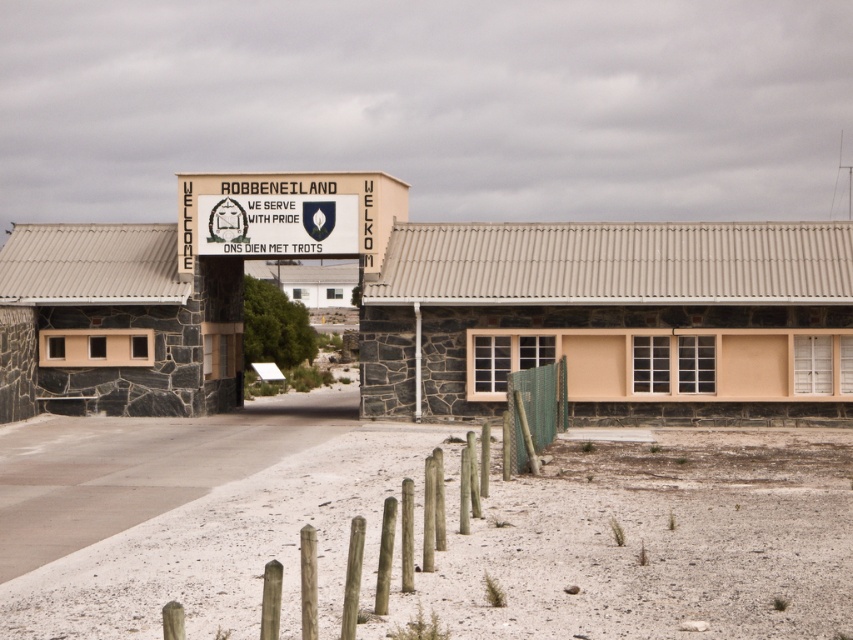
You are standing at the entrance of the building labeled ROBBENEILAND and want to walk towards the two points marked on the ground. Which point, point (277, 237) or point (543, 371), is closer to you as you face the building?

Point (277, 237) is closer to you because it is further to the viewer than point (543, 371).

You are a visitor approaching the entrance of the building. You notice a white plastic sign at center and a green mesh fence at lower center. Which object is taller?

The white plastic sign at center is taller than the green mesh fence at lower center.